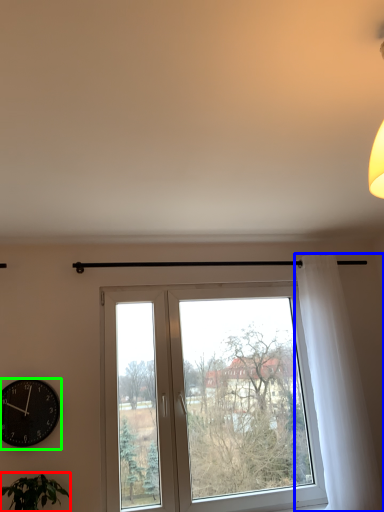
Question: Which is nearer to the houseplant (highlighted by a red box)? curtain (highlighted by a blue box) or wall clock (highlighted by a green box).

Choices:
 (A) curtain
 (B) wall clock

Answer: (B)